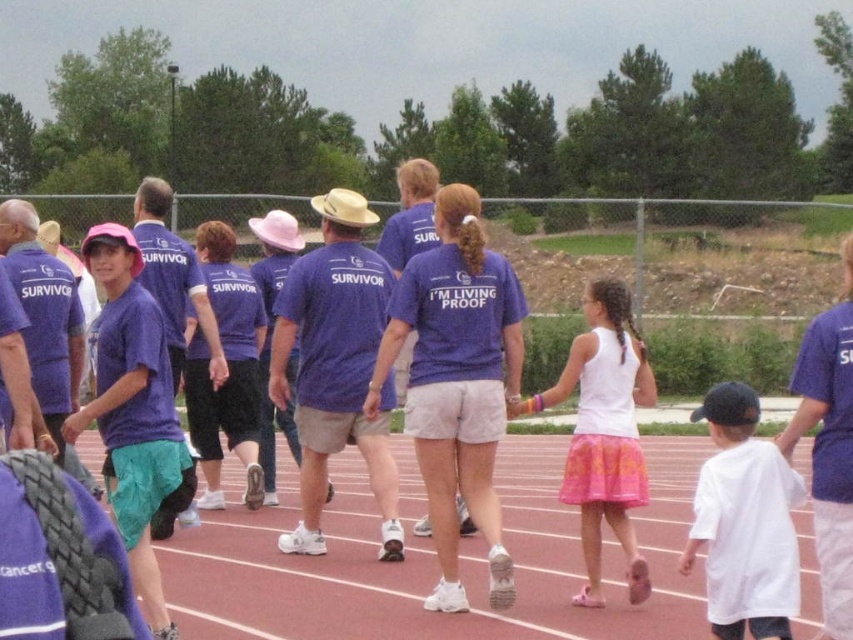
Who is higher up, matte purple shirt at center or white cotton shirt at lower right?

matte purple shirt at center is above.

Does point (125, 362) come in front of point (714, 481)?

That is False.

Between point (158, 316) and point (715, 541), which one is positioned in front?

Point (715, 541)

Find the location of a particular element. The height and width of the screenshot is (640, 853). matte purple shirt at center is located at coordinates (132, 408).

Does point (585, 630) come farther from viewer compared to point (593, 292)?

That is False.

The image size is (853, 640). Find the location of `red rubber track at center`. red rubber track at center is located at coordinates (434, 563).

The image size is (853, 640). What do you see at coordinates (434, 563) in the screenshot? I see `red rubber track at center` at bounding box center [434, 563].

The image size is (853, 640). I want to click on red rubber track at center, so click(x=434, y=563).

Is red rubber track at center smaller than matte purple shirt at center?

Yes.

Who is more distant from viewer, (625, 621) or (125, 342)?

Positioned behind is point (625, 621).

Locate an element on the screen. red rubber track at center is located at coordinates (434, 563).